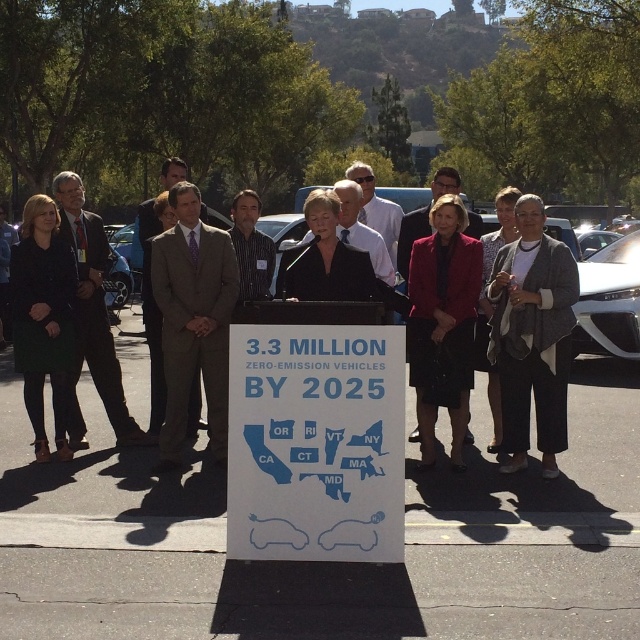
Question: Which point is farther from the camera taking this photo?

Choices:
 (A) (632, 308)
 (B) (458, 188)
 (C) (234, 204)

Answer: (A)

Question: Is white asphalt at center above white glossy car at right?

Choices:
 (A) yes
 (B) no

Answer: (B)

Question: Is blue paper sign at center wider than white shirt at center?

Choices:
 (A) no
 (B) yes

Answer: (B)

Question: Which of the following is the farthest from the observer?

Choices:
 (A) (35, 474)
 (B) (378, 552)

Answer: (A)

Question: Which point is closer to the camera?

Choices:
 (A) (232, 380)
 (B) (168, 413)
 (C) (54, 388)

Answer: (A)

Question: Is white asphalt at center closer to camera compared to matte black coat at left?

Choices:
 (A) no
 (B) yes

Answer: (A)